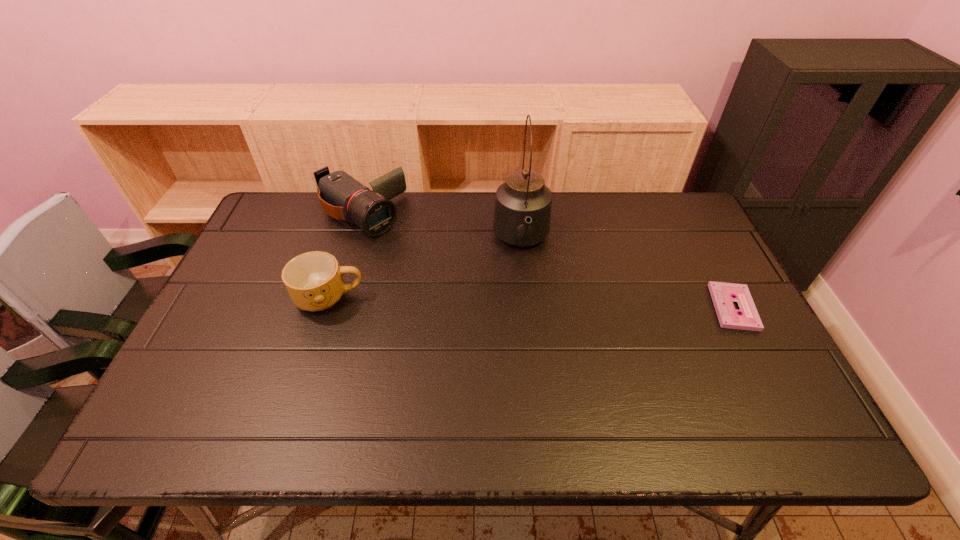
This screenshot has width=960, height=540. Find the location of `vacant space at the near edge of the desktop`. vacant space at the near edge of the desktop is located at coordinates (525, 401).

Locate an element on the screen. vacant space at the left edge of the desktop is located at coordinates (233, 340).

The image size is (960, 540). In the image, there is a desktop. In order to click on vacant space at the right edge in this screenshot , I will do `click(688, 319)`.

Where is `free space at the far left corner`? The height and width of the screenshot is (540, 960). free space at the far left corner is located at coordinates (259, 225).

This screenshot has width=960, height=540. I want to click on vacant space at the near left corner of the desktop, so click(226, 386).

Image resolution: width=960 pixels, height=540 pixels. Identify the location of vacant space at the far right corner. (669, 232).

Where is `unoccupied position between the second object from right to left and the rightmost object`? This screenshot has width=960, height=540. unoccupied position between the second object from right to left and the rightmost object is located at coordinates (627, 274).

Where is `unoccupied position between the third tallest object and the videotape`? The image size is (960, 540). unoccupied position between the third tallest object and the videotape is located at coordinates (531, 302).

Locate an element on the screen. unoccupied position between the videotape and the kettle is located at coordinates (627, 274).

At what (x,y) coordinates should I click in order to perform the action: click on free space between the third tallest object and the shortest object. Please return your answer as a coordinate pair (x, y). This screenshot has height=540, width=960. Looking at the image, I should click on (531, 302).